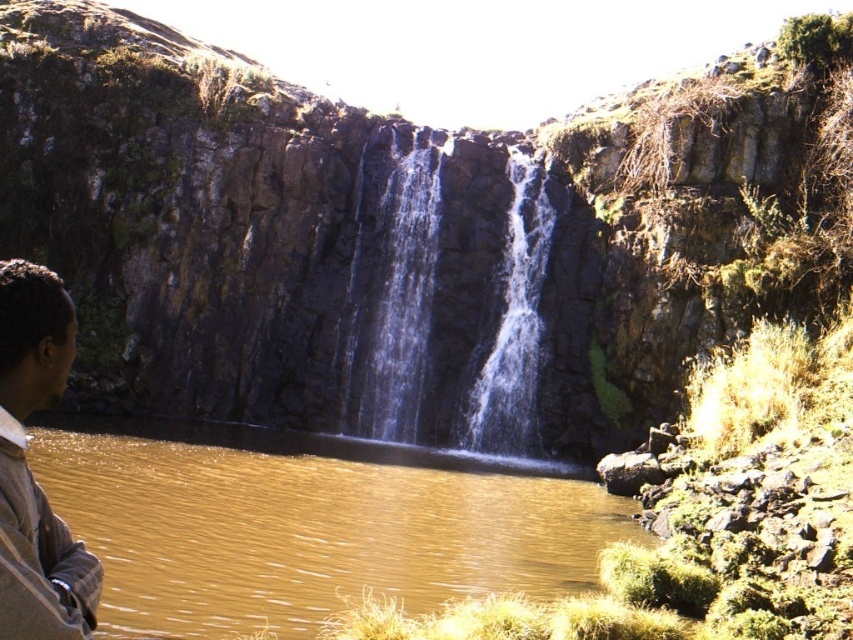
Question: Among these points, which one is farthest from the camera?

Choices:
 (A) (61, 392)
 (B) (376, 385)

Answer: (B)

Question: Where is brown plaid shirt at lower left located in relation to clear glass waterfall at center in the image?

Choices:
 (A) right
 (B) left

Answer: (B)

Question: Which object appears closest to the camera in this image?

Choices:
 (A) brown plaid shirt at lower left
 (B) clear water at center
 (C) brown liquid water at center

Answer: (A)

Question: Which point appears closest to the camera in this image?

Choices:
 (A) (7, 509)
 (B) (500, 364)

Answer: (A)

Question: Can you confirm if brown plaid shirt at lower left is positioned to the right of clear water at center?

Choices:
 (A) no
 (B) yes

Answer: (A)

Question: Can you confirm if brown plaid shirt at lower left is smaller than clear water at center?

Choices:
 (A) yes
 (B) no

Answer: (B)